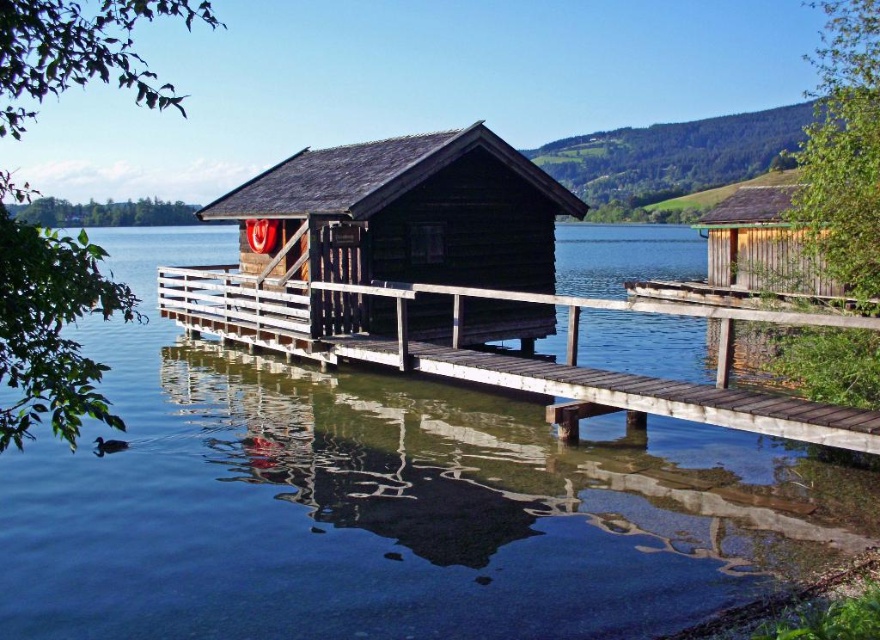
Can you confirm if dark brown wooden cabin at center is positioned below wooden dock at center?

Actually, dark brown wooden cabin at center is above wooden dock at center.

Which is more to the left, dark brown wooden cabin at center or wooden dock at center?

From the viewer's perspective, dark brown wooden cabin at center appears more on the left side.

Is point (503, 195) positioned behind point (181, 298)?

No, (503, 195) is closer to viewer.

You are a GUI agent. You are given a task and a screenshot of the screen. Output one action in this format:
    pyautogui.click(x=<x>, y=<y>)
    Task: Click on the dark brown wooden cabin at center
    The width and height of the screenshot is (880, 640).
    Given the screenshot: What is the action you would take?
    pyautogui.click(x=402, y=214)

Is point (528, 364) farther from viewer compared to point (730, 236)?

No, it is not.

Who is lower down, wooden dock at center or wooden cabin at right?

wooden dock at center

Locate an element on the screen. The image size is (880, 640). wooden dock at center is located at coordinates (504, 352).

This screenshot has width=880, height=640. I want to click on wooden dock at center, so click(x=504, y=352).

Is transparent water at dock center smaller than wooden cabin at right?

Correct, transparent water at dock center occupies less space than wooden cabin at right.

Identify the location of transparent water at dock center. The width and height of the screenshot is (880, 640). (385, 502).

Which is in front, point (500, 541) or point (761, 275)?

Positioned in front is point (500, 541).

Identify the location of transparent water at dock center. (385, 502).